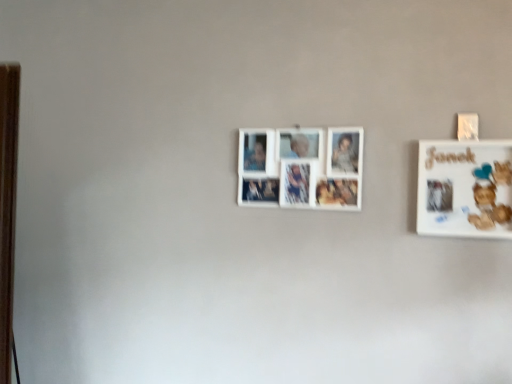
Describe the element at coordinates (302, 168) in the screenshot. I see `white matte picture frame at center, the 2th picture frame positioned from the front` at that location.

Identify the location of white matte picture frame at center, the 2th picture frame in the right-to-left sequence. (302, 168).

How much space does white matte picture frame at center, the first picture frame positioned from the back, occupy horizontally?

The width of white matte picture frame at center, the first picture frame positioned from the back, is 2.18 inches.

In order to face white matte board at upper right, the 2th picture frame in the left-to-right sequence, should I rotate leftwards or rightwards?

You should rotate right by 25.535 degrees.

What is the approximate width of white matte board at upper right, the 2th picture frame from the back?

The width of white matte board at upper right, the 2th picture frame from the back, is 2.82 inches.

The image size is (512, 384). What do you see at coordinates (465, 188) in the screenshot?
I see `white matte board at upper right, the 1th picture frame when ordered from right to left` at bounding box center [465, 188].

At what (x,y) coordinates should I click in order to perform the action: click on white matte board at upper right, the 1th picture frame when ordered from right to left. Please return your answer as a coordinate pair (x, y). The height and width of the screenshot is (384, 512). Looking at the image, I should click on (465, 188).

The width and height of the screenshot is (512, 384). In order to click on white matte picture frame at center, the 1th picture frame in the left-to-right sequence in this screenshot , I will do `click(302, 168)`.

Would you say white matte picture frame at center, the 2th picture frame in the right-to-left sequence, is to the left or to the right of white matte board at upper right, the 1th picture frame when ordered from front to back, in the picture?

Based on their positions, white matte picture frame at center, the 2th picture frame in the right-to-left sequence, is located to the left of white matte board at upper right, the 1th picture frame when ordered from front to back.

Is white matte picture frame at center, the 2th picture frame in the right-to-left sequence, in front of or behind white matte board at upper right, the 1th picture frame when ordered from front to back, in the image?

In the image, white matte picture frame at center, the 2th picture frame in the right-to-left sequence, appears behind white matte board at upper right, the 1th picture frame when ordered from front to back.

Is point (327, 203) farther from camera compared to point (444, 180)?

Yes, it is behind point (444, 180).

From the image's perspective, is white matte picture frame at center, the 2th picture frame positioned from the front, above or below white matte board at upper right, the 1th picture frame when ordered from right to left?

Clearly, from the image's perspective, white matte picture frame at center, the 2th picture frame positioned from the front, is above white matte board at upper right, the 1th picture frame when ordered from right to left.

From a real-world perspective, is white matte picture frame at center, the 2th picture frame in the right-to-left sequence, positioned above or below white matte board at upper right, the 2th picture frame from the back?

From a real-world perspective, white matte picture frame at center, the 2th picture frame in the right-to-left sequence, is physically above white matte board at upper right, the 2th picture frame from the back.

Considering the relative sizes of white matte picture frame at center, the first picture frame positioned from the back, and white matte board at upper right, the 2th picture frame from the back, in the image provided, is white matte picture frame at center, the first picture frame positioned from the back, thinner than white matte board at upper right, the 2th picture frame from the back,?

Correct, the width of white matte picture frame at center, the first picture frame positioned from the back, is less than that of white matte board at upper right, the 2th picture frame from the back.

Can you confirm if white matte picture frame at center, the 1th picture frame in the left-to-right sequence, is taller than white matte board at upper right, the 2th picture frame in the left-to-right sequence?

No, white matte picture frame at center, the 1th picture frame in the left-to-right sequence, is not taller than white matte board at upper right, the 2th picture frame in the left-to-right sequence.

Based on the photo, who is smaller, white matte picture frame at center, the first picture frame positioned from the back, or white matte board at upper right, the 2th picture frame in the left-to-right sequence?

white matte board at upper right, the 2th picture frame in the left-to-right sequence.

Based on the photo, is white matte board at upper right, the 1th picture frame when ordered from right to left, a part of white matte picture frame at center, the 1th picture frame in the left-to-right sequence?

No, white matte picture frame at center, the 1th picture frame in the left-to-right sequence, does not contain white matte board at upper right, the 1th picture frame when ordered from right to left.

Is white matte picture frame at center, the 2th picture frame in the right-to-left sequence, placed right next to white matte board at upper right, the 1th picture frame when ordered from front to back?

No, white matte picture frame at center, the 2th picture frame in the right-to-left sequence, is not in contact with white matte board at upper right, the 1th picture frame when ordered from front to back.

Is white matte picture frame at center, the 1th picture frame in the left-to-right sequence, looking in the opposite direction of white matte board at upper right, the 1th picture frame when ordered from front to back?

No, white matte picture frame at center, the 1th picture frame in the left-to-right sequence, is not facing the opposite direction of white matte board at upper right, the 1th picture frame when ordered from front to back.

What's the angular difference between white matte picture frame at center, the 2th picture frame positioned from the front, and white matte board at upper right, the 1th picture frame when ordered from right to left,'s facing directions?

They differ by 0.000966 degrees in their facing directions.

Locate an element on the screen. Image resolution: width=512 pixels, height=384 pixels. picture frame that is above the white matte board at upper right, the 1th picture frame when ordered from front to back (from a real-world perspective) is located at coordinates (302, 168).

Which object is positioned more to the left, white matte board at upper right, the 1th picture frame when ordered from front to back, or white matte picture frame at center, the 2th picture frame positioned from the front?

From the viewer's perspective, white matte picture frame at center, the 2th picture frame positioned from the front, appears more on the left side.

Which object is closer to the camera, white matte board at upper right, the 2th picture frame from the back, or white matte picture frame at center, the 2th picture frame positioned from the front?

white matte board at upper right, the 2th picture frame from the back, is in front.

Considering the positions of point (443, 209) and point (300, 147), is point (443, 209) closer or farther from the camera than point (300, 147)?

Point (443, 209).

From the image's perspective, is white matte board at upper right, the 1th picture frame when ordered from right to left, above or below white matte picture frame at center, the 2th picture frame positioned from the front?

From the image's perspective, white matte board at upper right, the 1th picture frame when ordered from right to left, appears below white matte picture frame at center, the 2th picture frame positioned from the front.

From a real-world perspective, is white matte board at upper right, the 1th picture frame when ordered from front to back, positioned over white matte picture frame at center, the first picture frame positioned from the back, based on gravity?

Actually, white matte board at upper right, the 1th picture frame when ordered from front to back, is physically below white matte picture frame at center, the first picture frame positioned from the back, in the real world.

Which of these two, white matte board at upper right, the 2th picture frame from the back, or white matte picture frame at center, the 2th picture frame positioned from the front, is thinner?

With smaller width is white matte picture frame at center, the 2th picture frame positioned from the front.

Between white matte board at upper right, the 1th picture frame when ordered from front to back, and white matte picture frame at center, the 2th picture frame positioned from the front, which one has more height?

white matte board at upper right, the 1th picture frame when ordered from front to back, is taller.

Based on their sizes in the image, would you say white matte board at upper right, the 2th picture frame from the back, is bigger or smaller than white matte picture frame at center, the 1th picture frame in the left-to-right sequence?

Considering their sizes, white matte board at upper right, the 2th picture frame from the back, takes up less space than white matte picture frame at center, the 1th picture frame in the left-to-right sequence.

Is white matte picture frame at center, the 1th picture frame in the left-to-right sequence, a part of white matte board at upper right, the 1th picture frame when ordered from front to back?

That's incorrect, white matte picture frame at center, the 1th picture frame in the left-to-right sequence, is not inside white matte board at upper right, the 1th picture frame when ordered from front to back.

Would you say white matte board at upper right, the 1th picture frame when ordered from right to left, is a long distance from white matte picture frame at center, the 2th picture frame positioned from the front?

No, white matte board at upper right, the 1th picture frame when ordered from right to left, is not far away from white matte picture frame at center, the 2th picture frame positioned from the front.

Is white matte board at upper right, the 1th picture frame when ordered from right to left, looking in the opposite direction of white matte picture frame at center, the 2th picture frame positioned from the front?

No, white matte board at upper right, the 1th picture frame when ordered from right to left,'s orientation is not away from white matte picture frame at center, the 2th picture frame positioned from the front.

Could you measure the distance between white matte board at upper right, the 1th picture frame when ordered from right to left, and white matte picture frame at center, the 1th picture frame in the left-to-right sequence?

white matte board at upper right, the 1th picture frame when ordered from right to left, and white matte picture frame at center, the 1th picture frame in the left-to-right sequence, are 14.21 inches apart.

I want to click on picture frame lying on the left of white matte board at upper right, the 2th picture frame from the back, so click(302, 168).

Where is `picture frame lying behind the white matte board at upper right, the 2th picture frame in the left-to-right sequence`? picture frame lying behind the white matte board at upper right, the 2th picture frame in the left-to-right sequence is located at coordinates (302, 168).

The width and height of the screenshot is (512, 384). I want to click on picture frame above the white matte board at upper right, the 1th picture frame when ordered from right to left (from a real-world perspective), so click(x=302, y=168).